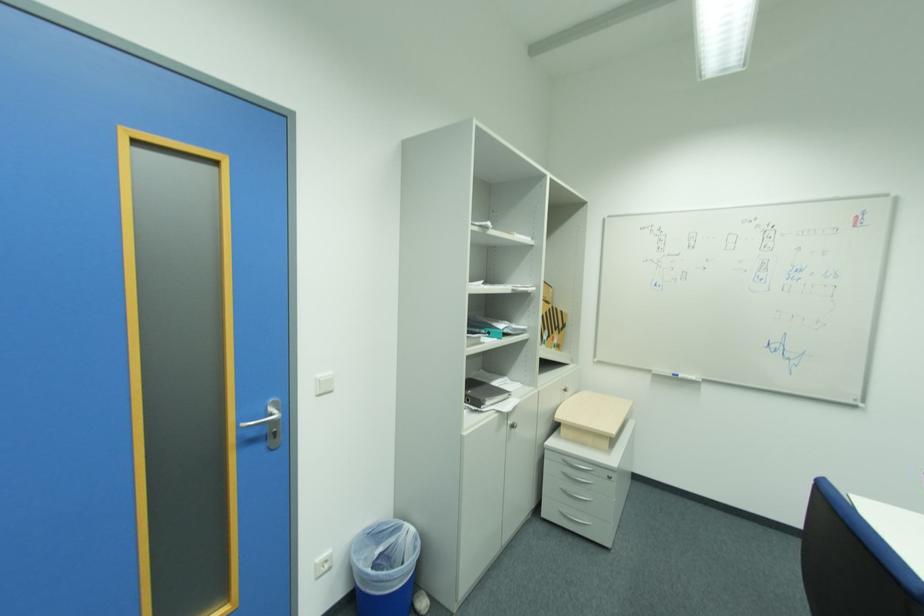
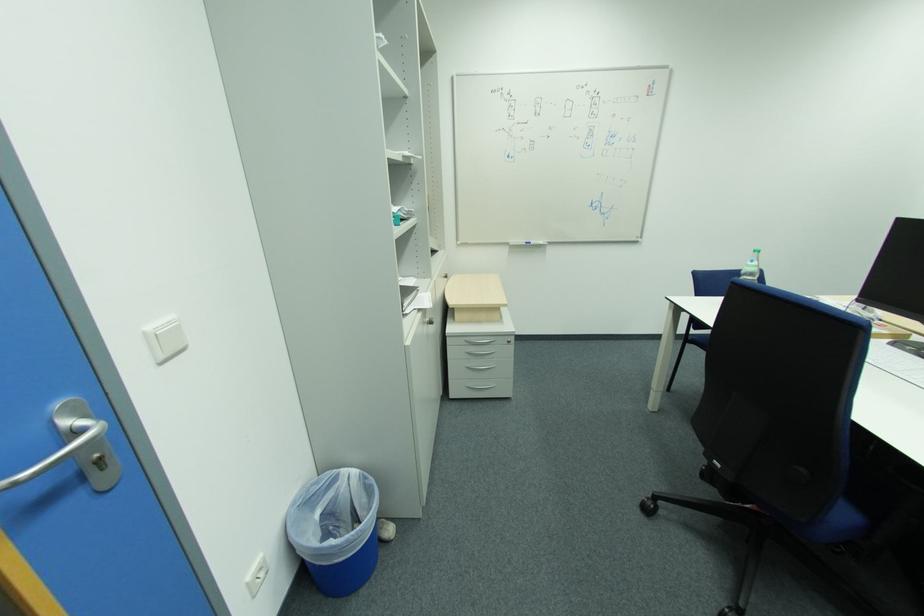
Where in the second image is the point corresponding to pixel 373 533 from the first image?

(304, 507)